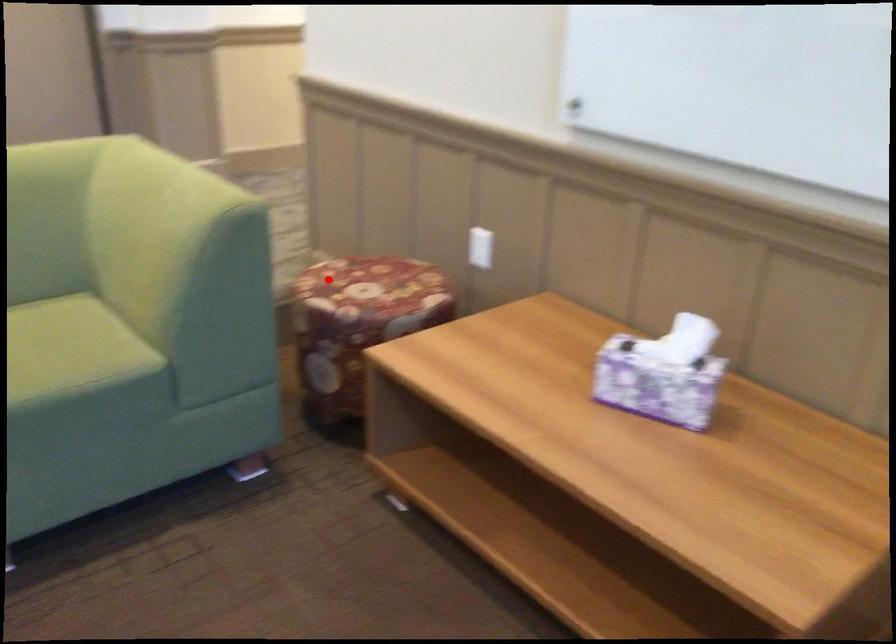
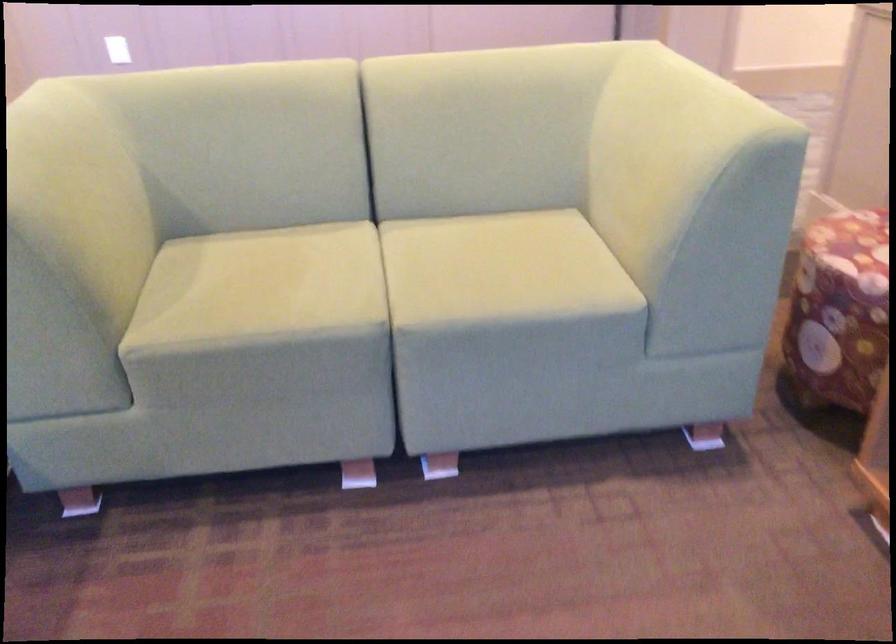
Question: I am providing you with two images of the same scene from different viewpoints. Given a red point in image1, look at the same physical point in image2. Is it:

Choices:
 (A) Closer to the viewpoint
 (B) Farther from the viewpoint

Answer: (A)